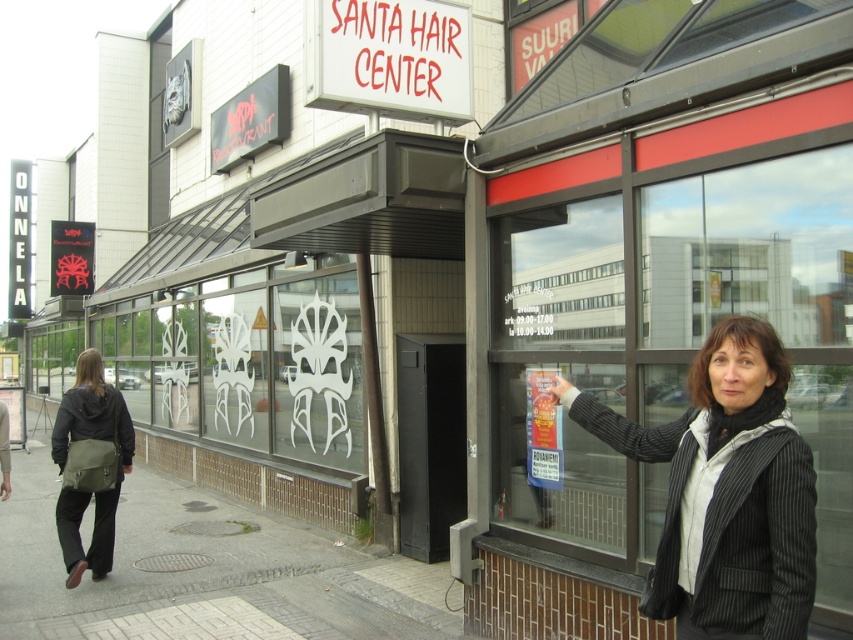
You are a GUI agent. You are given a task and a screenshot of the screen. Output one action in this format:
    pyautogui.click(x=<x>, y=<y>)
    Task: Click on the gray concrete sidewalk at lower left
    The height and width of the screenshot is (640, 853).
    Given the screenshot: What is the action you would take?
    pyautogui.click(x=204, y=572)

Which is in front, point (247, 602) or point (74, 576)?

Point (247, 602) is more forward.

Is point (155, 536) closer to viewer compared to point (93, 353)?

That is False.

The image size is (853, 640). Identify the location of gray concrete sidewalk at lower left. (204, 572).

Does transparent glass window at center have a greater width compared to gray concrete sidewalk at lower left?

Yes, transparent glass window at center is wider than gray concrete sidewalk at lower left.

Based on the photo, does transparent glass window at center have a smaller size compared to gray concrete sidewalk at lower left?

Actually, transparent glass window at center might be larger than gray concrete sidewalk at lower left.

Does point (717, 243) lie in front of point (55, 572)?

Yes.

Where is `transparent glass window at center`? The image size is (853, 640). transparent glass window at center is located at coordinates (668, 328).

Can you confirm if gray concrete sidewalk at lower left is shorter than black pinstripe blazer at lower right?

Indeed, gray concrete sidewalk at lower left has a lesser height compared to black pinstripe blazer at lower right.

I want to click on gray concrete sidewalk at lower left, so click(204, 572).